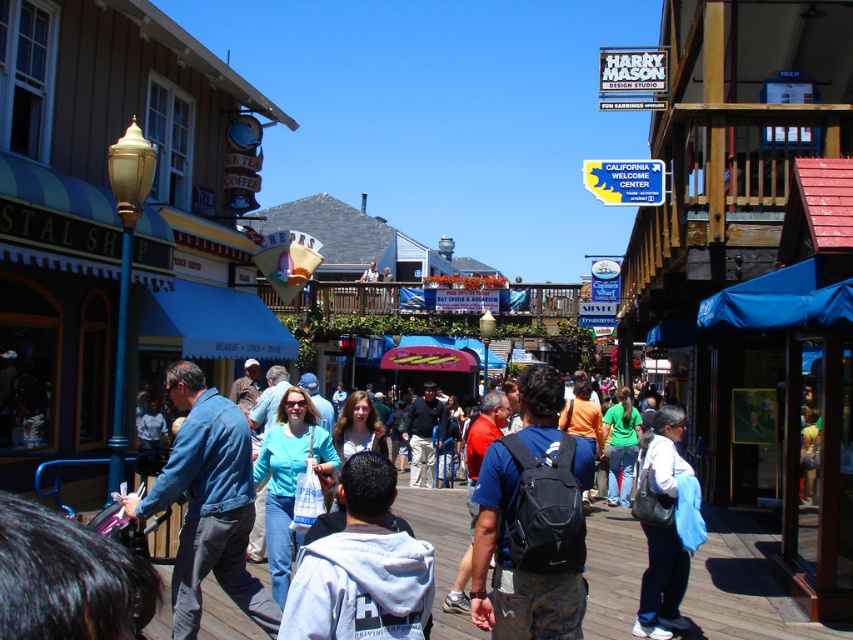
Question: Which of the following is the farthest from the observer?

Choices:
 (A) denim jacket at center
 (B) denim jacket at lower left
 (C) white cotton shirt at center

Answer: (C)

Question: In this image, where is denim jacket at lower left located relative to denim jacket at center?

Choices:
 (A) left
 (B) right

Answer: (A)

Question: Where is denim jacket at lower left located in relation to white cotton shirt at center in the image?

Choices:
 (A) above
 (B) below

Answer: (A)

Question: Which point is closer to the camera?

Choices:
 (A) (666, 545)
 (B) (634, 552)
 (C) (262, 620)

Answer: (C)

Question: Can you confirm if denim jacket at lower left is positioned to the left of denim jacket at center?

Choices:
 (A) yes
 (B) no

Answer: (A)

Question: Among these points, which one is farthest from the camera?

Choices:
 (A) (241, 467)
 (B) (672, 566)

Answer: (B)